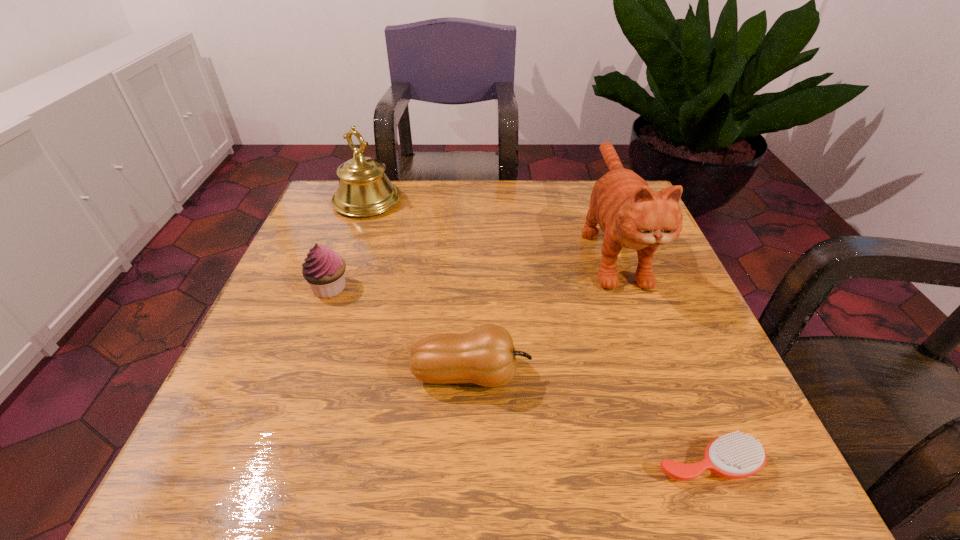
This screenshot has width=960, height=540. What are the coordinates of `vacant space located 0.180m on the stem side of the third object from left to right` in the screenshot? It's located at (636, 375).

Find the location of `vacant area situated on the left of the shortest object`. vacant area situated on the left of the shortest object is located at coordinates (619, 463).

At what (x,y) coordinates should I click in order to perform the action: click on cat located in the far edge section of the desktop. Please return your answer as a coordinate pair (x, y). The image size is (960, 540). Looking at the image, I should click on (631, 215).

Identify the location of bell that is positioned at the far edge. The width and height of the screenshot is (960, 540). (364, 190).

The height and width of the screenshot is (540, 960). I want to click on object located at the near edge, so click(x=735, y=455).

Identify the location of bell present at the left edge. The width and height of the screenshot is (960, 540). (364, 190).

Image resolution: width=960 pixels, height=540 pixels. I want to click on cupcake positioned at the left edge, so click(x=323, y=269).

At what (x,y) coordinates should I click in order to perform the action: click on cat that is at the right edge. Please return your answer as a coordinate pair (x, y). Looking at the image, I should click on (631, 215).

This screenshot has height=540, width=960. Identify the location of hairbrush present at the right edge. (735, 455).

Locate an element on the screen. This screenshot has width=960, height=540. object situated at the far left corner is located at coordinates (364, 190).